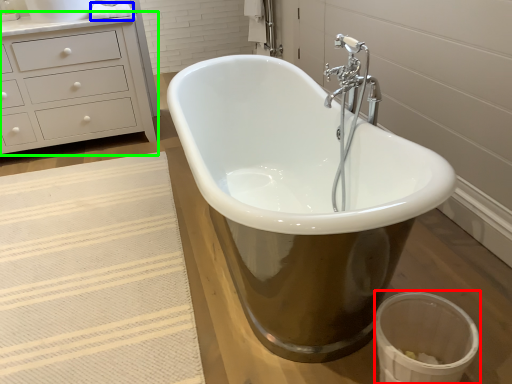
Question: Which is farther away from toilet bowl (highlighted by a red box)? toilet paper (highlighted by a blue box) or chest of drawers (highlighted by a green box)?

Choices:
 (A) toilet paper
 (B) chest of drawers

Answer: (A)